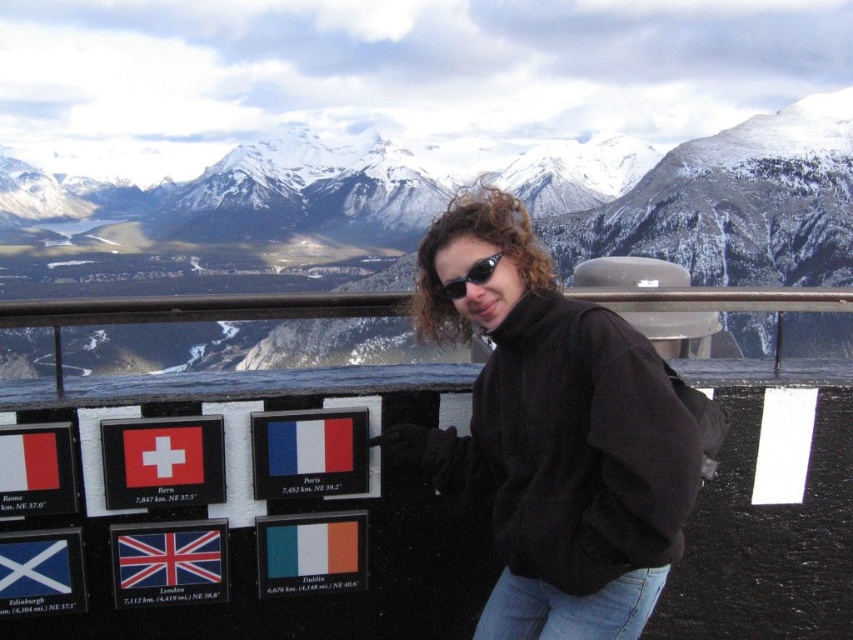
You are a photographer trying to capture the best shot of the person and the flags. You notice two points in the scene labeled as point (714, 241) and point (137, 552). Which point is closer to your camera?

Point (137, 552) is closer to the camera because the description states that point (714, 241) is further away than point (137, 552).

You are a traveler who wants to know which flag is taller between the green matte flag at lower center and the matte plastic flag at center. Based on the scene, can you tell me which one is taller?

The green matte flag at lower center has a greater height compared to the matte plastic flag at center, so the green matte flag at lower center is taller.

You are a traveler standing at point (167, 557). You see a matte plastic flag at center. Which direction should you face to see the snow covered mountains in the background?

The snow covered mountains are in the background, so you should face away from the matte plastic flag at center to see them.